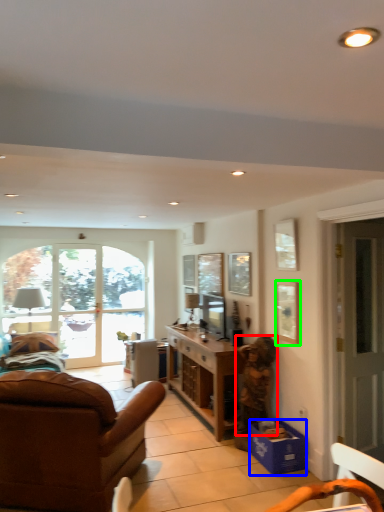
Question: Considering the real-world distances, which object is farthest from person (highlighted by a red box)? box (highlighted by a blue box) or picture frame (highlighted by a green box)?

Choices:
 (A) box
 (B) picture frame

Answer: (B)